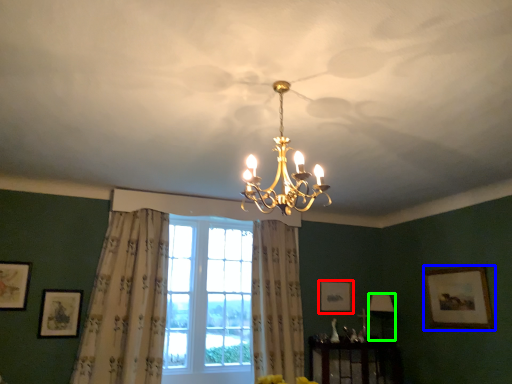
Question: Considering the real-world distances, which object is farthest from picture frame (highlighted by a red box)? picture frame (highlighted by a blue box) or lamp (highlighted by a green box)?

Choices:
 (A) picture frame
 (B) lamp

Answer: (A)